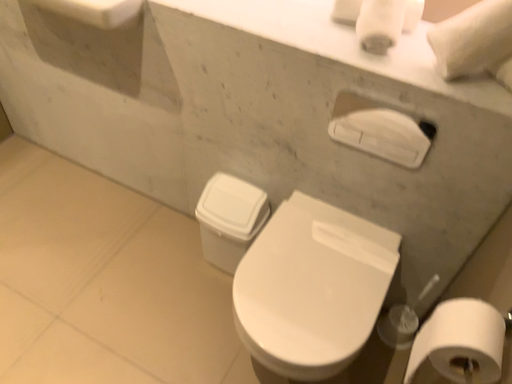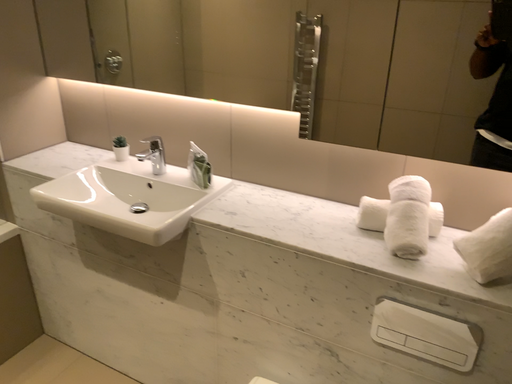
Question: Which way did the camera rotate in the video?

Choices:
 (A) rotated upward
 (B) rotated downward

Answer: (A)